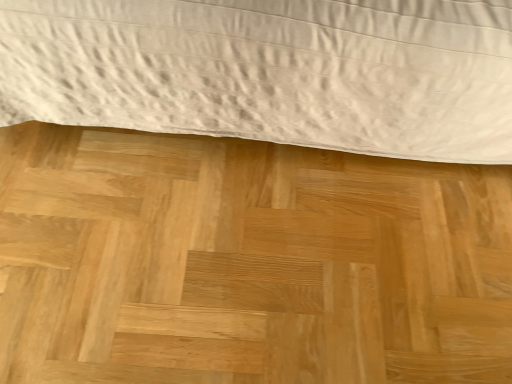
You are a GUI agent. You are given a task and a screenshot of the screen. Output one action in this format:
    pyautogui.click(x=<x>, y=<y>)
    Task: Click on the natural wood plywood at center
    The image size is (512, 384).
    Given the screenshot: What is the action you would take?
    pyautogui.click(x=247, y=263)

This screenshot has width=512, height=384. What do you see at coordinates (247, 263) in the screenshot? I see `natural wood plywood at center` at bounding box center [247, 263].

In order to face white textured bed at upper center, should I rotate leftwards or rightwards?

Turn right approximately 3.304 degrees to face it.

The image size is (512, 384). What do you see at coordinates (270, 71) in the screenshot?
I see `white textured bed at upper center` at bounding box center [270, 71].

Find the location of a particular element. This screenshot has width=512, height=384. white textured bed at upper center is located at coordinates (270, 71).

This screenshot has height=384, width=512. I want to click on natural wood plywood at center, so click(247, 263).

Does natural wood plywood at center appear on the right side of white textured bed at upper center?

Incorrect, natural wood plywood at center is not on the right side of white textured bed at upper center.

Is the position of natural wood plywood at center more distant than that of white textured bed at upper center?

Yes, natural wood plywood at center is further from the viewer.

Does point (82, 149) come in front of point (405, 154)?

That is True.

From the image's perspective, between natural wood plywood at center and white textured bed at upper center, which one is located above?

white textured bed at upper center appears higher in the image.

In the scene shown: From a real-world perspective, between natural wood plywood at center and white textured bed at upper center, who is vertically higher?

white textured bed at upper center, from a real-world perspective.

Considering the relative sizes of natural wood plywood at center and white textured bed at upper center in the image provided, is natural wood plywood at center thinner than white textured bed at upper center?

No, natural wood plywood at center is not thinner than white textured bed at upper center.

Is natural wood plywood at center shorter than white textured bed at upper center?

Correct, natural wood plywood at center is not as tall as white textured bed at upper center.

Looking at the image, does natural wood plywood at center seem bigger or smaller compared to white textured bed at upper center?

natural wood plywood at center is smaller than white textured bed at upper center.

Is natural wood plywood at center situated inside white textured bed at upper center or outside?

natural wood plywood at center is outside white textured bed at upper center.

Is the surface of natural wood plywood at center in direct contact with white textured bed at upper center?

natural wood plywood at center and white textured bed at upper center are clearly separated.

Does natural wood plywood at center turn towards white textured bed at upper center?

No.

How many degrees apart are the facing directions of natural wood plywood at center and white textured bed at upper center?

There is a 89.5-degree angle between the facing directions of natural wood plywood at center and white textured bed at upper center.

At what (x,y) coordinates should I click in order to perform the action: click on bed in front of the natural wood plywood at center. Please return your answer as a coordinate pair (x, y). Looking at the image, I should click on (270, 71).

Which is more to the right, white textured bed at upper center or natural wood plywood at center?

From the viewer's perspective, white textured bed at upper center appears more on the right side.

Relative to natural wood plywood at center, is white textured bed at upper center in front or behind?

white textured bed at upper center is positioned closer to the viewer than natural wood plywood at center.

Which is closer, (320,135) or (277,216)?

Point (320,135) is positioned farther from the camera compared to point (277,216).

From the image's perspective, which is below, white textured bed at upper center or natural wood plywood at center?

From the image's view, natural wood plywood at center is below.

From a real-world perspective, is white textured bed at upper center physically below natural wood plywood at center?

No.

Considering the sizes of objects white textured bed at upper center and natural wood plywood at center in the image provided, who is thinner, white textured bed at upper center or natural wood plywood at center?

white textured bed at upper center.

From their relative heights in the image, would you say white textured bed at upper center is taller or shorter than natural wood plywood at center?

Considering their sizes, white textured bed at upper center has more height than natural wood plywood at center.

Based on the photo, who is bigger, white textured bed at upper center or natural wood plywood at center?

white textured bed at upper center.

Would you say natural wood plywood at center is part of white textured bed at upper center's contents?

No, white textured bed at upper center does not contain natural wood plywood at center.

Would you say white textured bed at upper center is a long distance from natural wood plywood at center?

No.

Is white textured bed at upper center oriented away from natural wood plywood at center?

No, natural wood plywood at center is not at the back of white textured bed at upper center.

What are the coordinates of `plywood behind the white textured bed at upper center` in the screenshot? It's located at (247, 263).

The image size is (512, 384). I want to click on plywood directly beneath the white textured bed at upper center (from a real-world perspective), so click(247, 263).

Locate an element on the screen. bed that appears on the right of natural wood plywood at center is located at coordinates pyautogui.click(x=270, y=71).